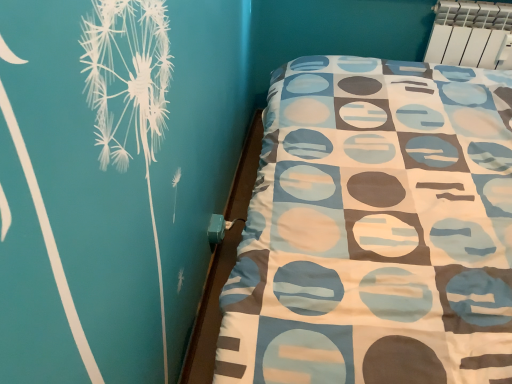
Question: From a real-world perspective, relative to white plastic radiator at upper right, is teal plastic bed frame at lower right vertically above or below?

Choices:
 (A) below
 (B) above

Answer: (A)

Question: From the image's perspective, is teal plastic bed frame at lower right above or below white plastic radiator at upper right?

Choices:
 (A) above
 (B) below

Answer: (B)

Question: Is teal plastic bed frame at lower right bigger or smaller than white plastic radiator at upper right?

Choices:
 (A) small
 (B) big

Answer: (A)

Question: Considering the positions of point (507, 33) and point (245, 155), is point (507, 33) closer or farther from the camera than point (245, 155)?

Choices:
 (A) farther
 (B) closer

Answer: (B)

Question: Would you say white plastic radiator at upper right is to the left or to the right of teal plastic bed frame at lower right in the picture?

Choices:
 (A) right
 (B) left

Answer: (A)

Question: From the image's perspective, relative to teal plastic bed frame at lower right, is white plastic radiator at upper right above or below?

Choices:
 (A) below
 (B) above

Answer: (B)

Question: Is white plastic radiator at upper right bigger or smaller than teal plastic bed frame at lower right?

Choices:
 (A) small
 (B) big

Answer: (B)